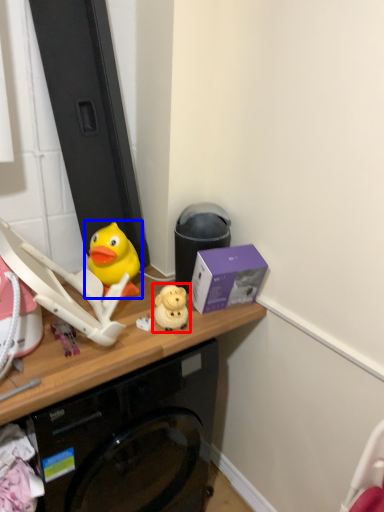
Question: Which object is closer to the camera taking this photo, toy (highlighted by a red box) or toy (highlighted by a blue box)?

Choices:
 (A) toy
 (B) toy

Answer: (A)